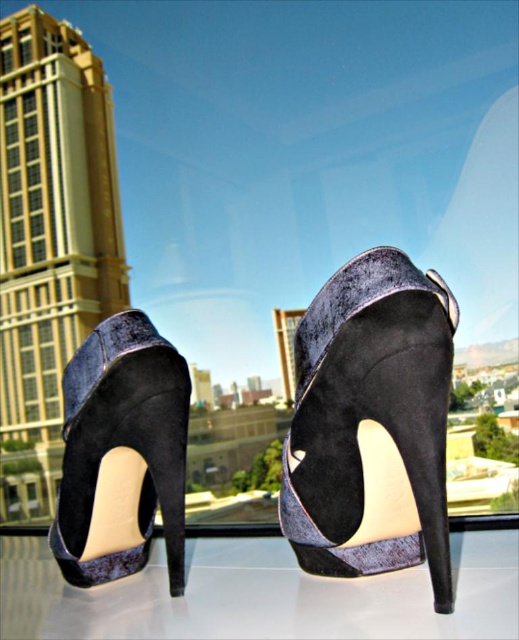
Question: Does transparent glass table at center appear on the left side of velvet black high-heeled shoe at center?

Choices:
 (A) yes
 (B) no

Answer: (A)

Question: Which point is farther to the camera?

Choices:
 (A) (345, 369)
 (B) (148, 456)
 (C) (422, 568)

Answer: (B)

Question: Which point is closer to the camera?

Choices:
 (A) velvet black high-heeled shoe at center
 (B) velvet-like black high-heeled shoe at center

Answer: (B)

Question: Does velvet-like black high-heeled shoe at center appear over velvet black high-heeled shoe at center?

Choices:
 (A) no
 (B) yes

Answer: (B)

Question: Which point is farther to the camera?

Choices:
 (A) velvet black high-heeled shoe at center
 (B) transparent glass table at center
 (C) velvet-like black high-heeled shoe at center

Answer: (A)

Question: Does transparent glass table at center appear under velvet black high-heeled shoe at center?

Choices:
 (A) no
 (B) yes

Answer: (B)